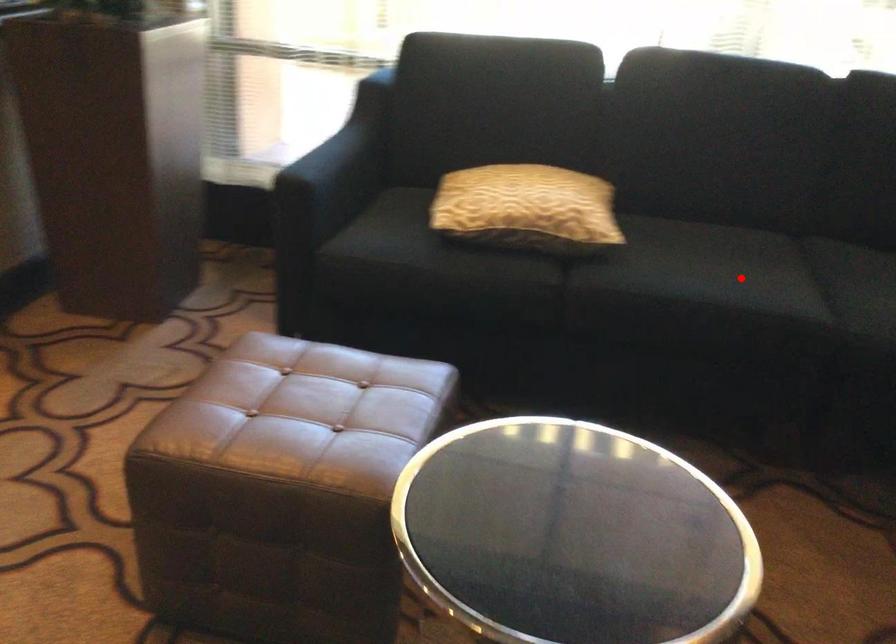
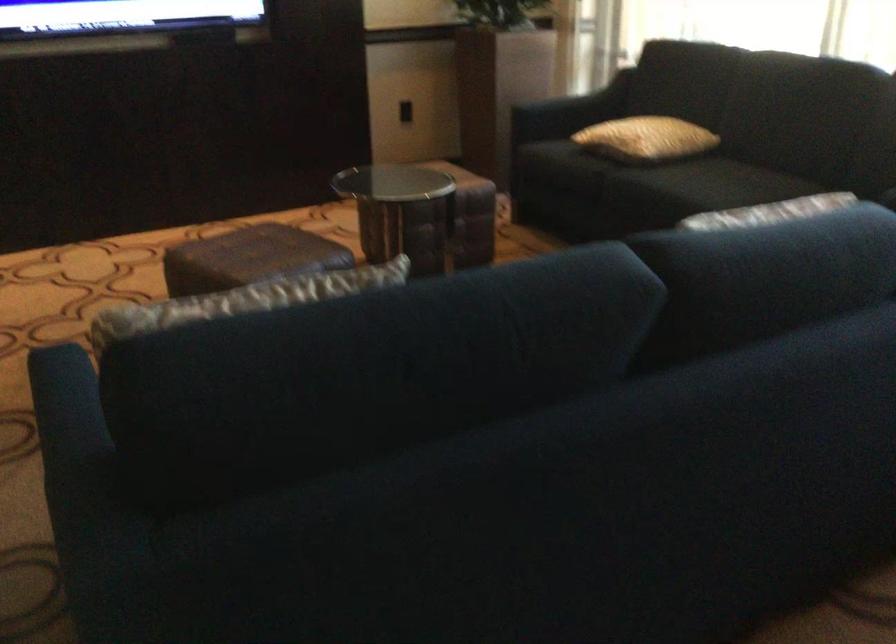
Question: I am providing you with two images of the same scene from different viewpoints. In image1, a red point is highlighted. Considering the same 3D point in image2, which of the following is correct?

Choices:
 (A) It is closer
 (B) It is farther

Answer: (B)